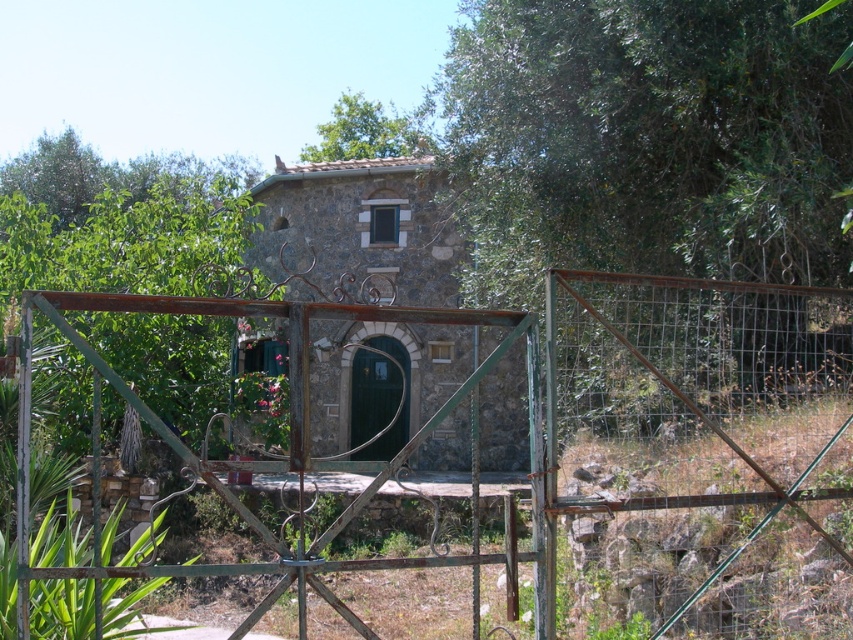
Does rusty metal gate at center have a lesser height compared to green matte door at center?

Yes, rusty metal gate at center is shorter than green matte door at center.

The image size is (853, 640). What are the coordinates of `rusty metal gate at center` in the screenshot? It's located at (554, 410).

This screenshot has width=853, height=640. I want to click on rusty metal gate at center, so click(x=554, y=410).